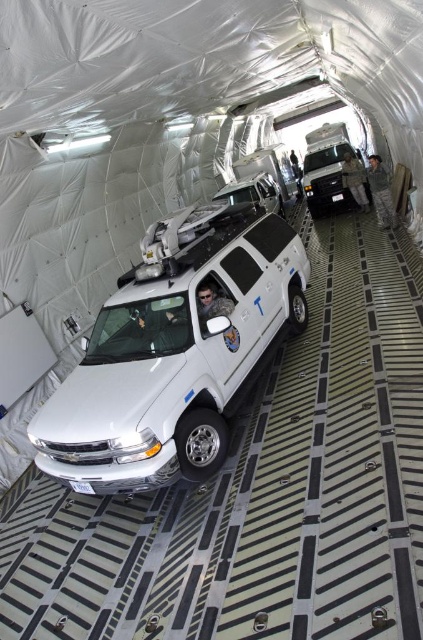
Does white glossy minivan at center have a smaller size compared to white matte van at center?

Yes.

Which of these two, white glossy minivan at center or white matte van at center, stands taller?

white matte van at center is taller.

This screenshot has height=640, width=423. Find the location of `white glossy minivan at center`. white glossy minivan at center is located at coordinates (173, 352).